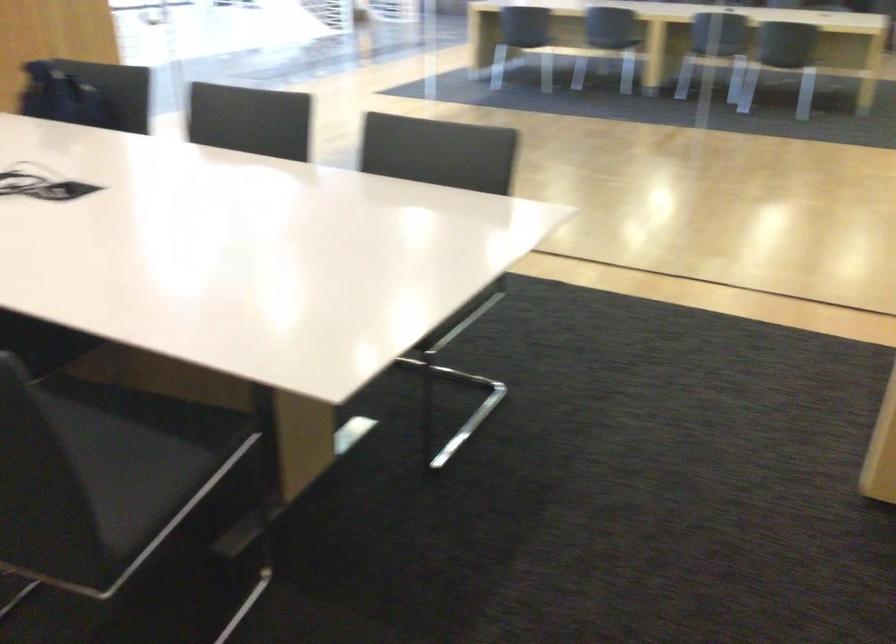
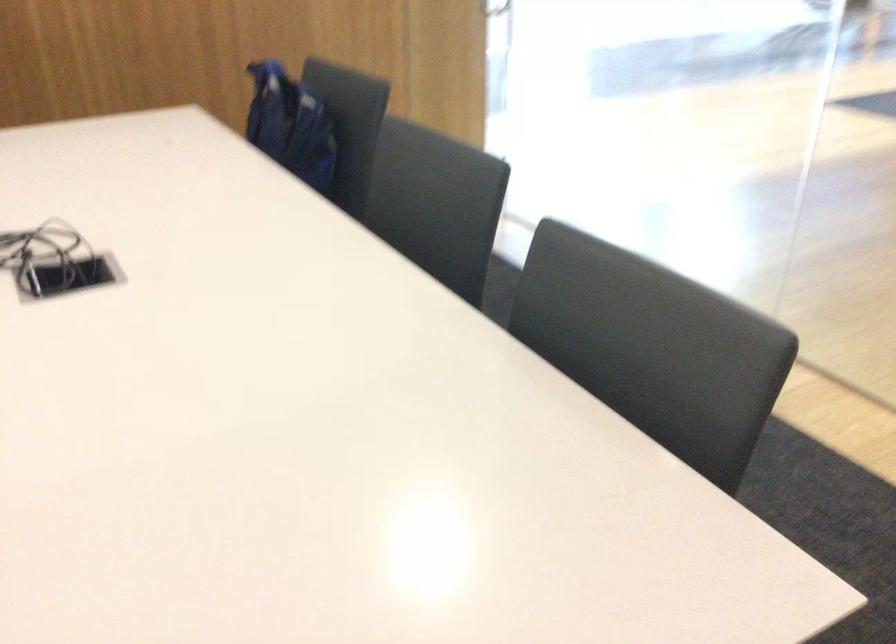
Locate, in the second image, the point that corresponds to the point at 71,104 in the first image.

(289, 125)